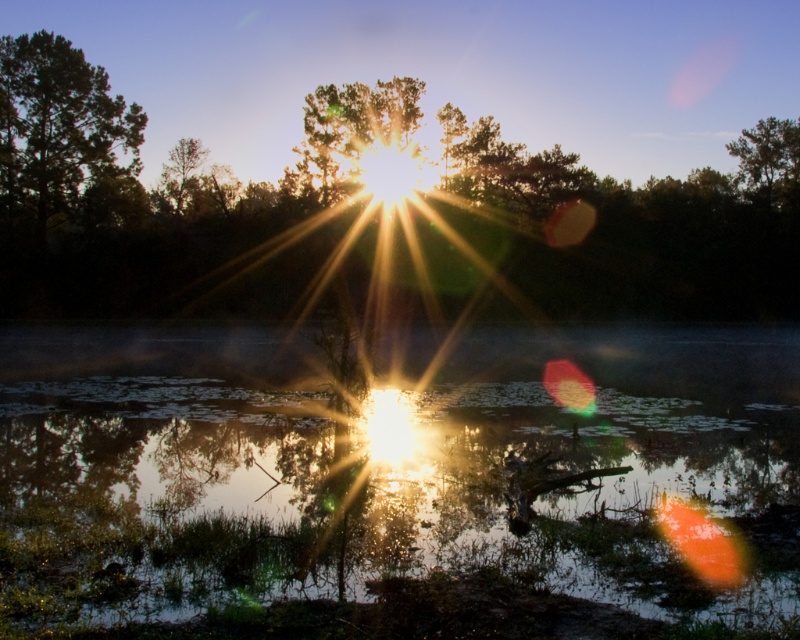
You are an artist trying to paint the scene. You want to ensure the green matte tree at upper left and the green matte tree at upper right are proportionally accurate. Which tree should you draw smaller?

The green matte tree at upper left should be drawn smaller because it has a smaller size compared to the green matte tree at upper right.

Based on the photo, you are a photographer trying to capture the reflection of the green matte tree at upper right in the transparent water at center. Based on their widths, will the tree fit entirely within the water surface?

The transparent water at center is wider than green matte tree at upper right, so the tree will fit entirely within the water surface.